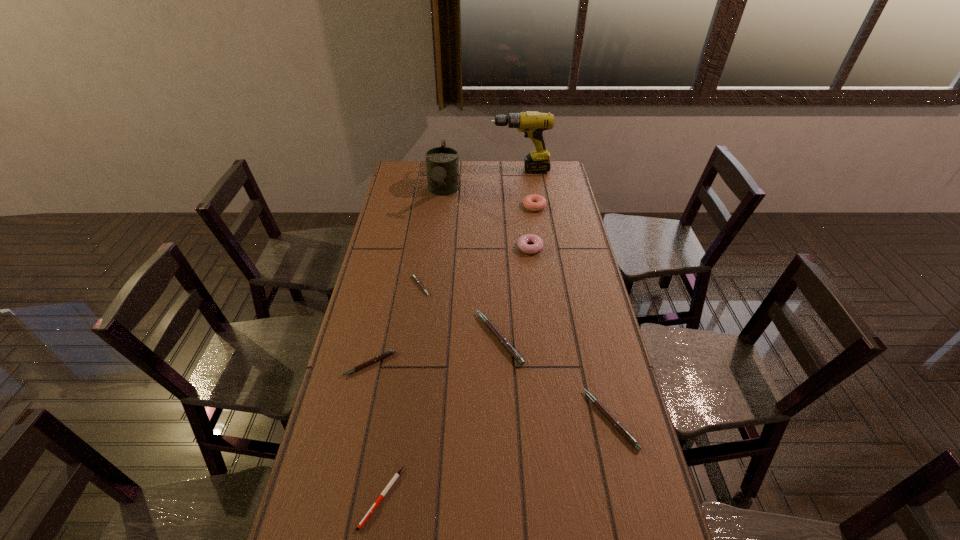
Identify which object is the sixth closest to the farthest pink pen. Please provide its 2D coordinates. Your answer should be formatted as a tuple, i.e. [(x, y)], where the tuple contains the x and y coordinates of a point satisfying the conditions above.

[(397, 474)]

Locate an element on the screen. This screenshot has width=960, height=540. pen that can be found as the third closest to the watering can is located at coordinates (381, 356).

Image resolution: width=960 pixels, height=540 pixels. Find the location of `the second closest pen to the tallest object`. the second closest pen to the tallest object is located at coordinates (x=513, y=352).

You are a GUI agent. You are given a task and a screenshot of the screen. Output one action in this format:
    pyautogui.click(x=<x>, y=<y>)
    Task: Click on the second closest pink pen to the fifth tallest object
    
    Given the screenshot: What is the action you would take?
    pyautogui.click(x=416, y=279)

You are a GUI agent. You are given a task and a screenshot of the screen. Output one action in this format:
    pyautogui.click(x=<x>, y=<y>)
    Task: Click on the second closest pink pen to the farther doughnut
    The image size is (960, 540).
    Given the screenshot: What is the action you would take?
    pyautogui.click(x=513, y=352)

Where is `free space that satisfies the following two spatial constraints: 1. at the nib of the tallest pen; 2. at the nib of the third shortest pen`? This screenshot has height=540, width=960. free space that satisfies the following two spatial constraints: 1. at the nib of the tallest pen; 2. at the nib of the third shortest pen is located at coordinates (500, 364).

Where is `free space that satisfies the following two spatial constraints: 1. with the spout on the green watering can; 2. on the right side of the purple doughnut`? This screenshot has width=960, height=540. free space that satisfies the following two spatial constraints: 1. with the spout on the green watering can; 2. on the right side of the purple doughnut is located at coordinates (437, 247).

Where is `vacant space that satisfies the following two spatial constraints: 1. at the nib of the fifth nearest object; 2. at the nib of the third shortest object`? vacant space that satisfies the following two spatial constraints: 1. at the nib of the fifth nearest object; 2. at the nib of the third shortest object is located at coordinates (409, 364).